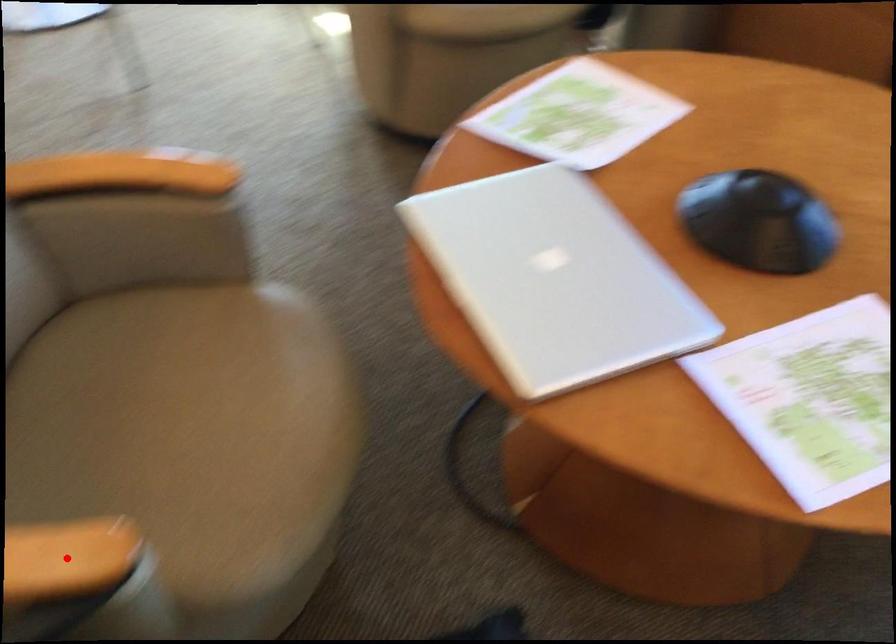
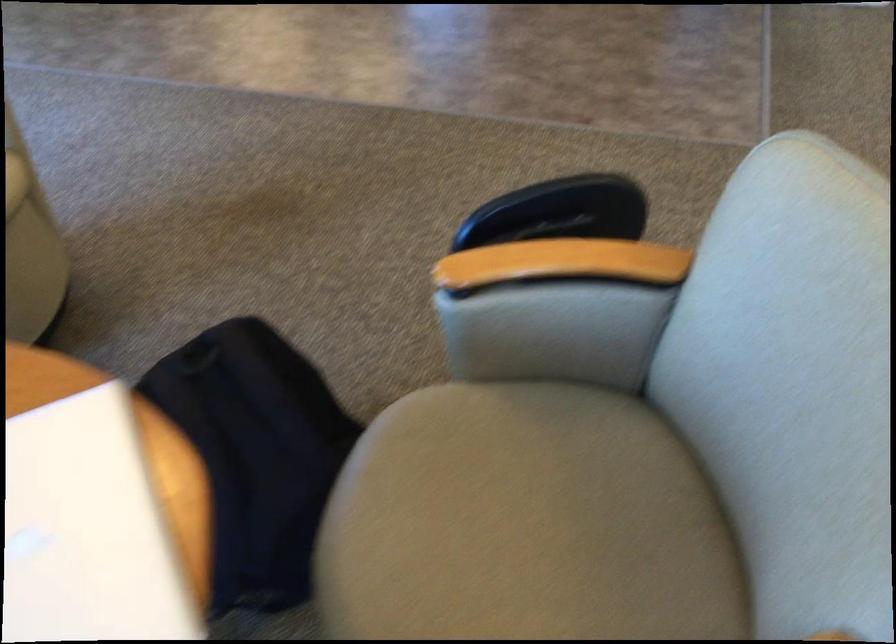
Question: I am providing you with two images of the same scene from different viewpoints. A red point is marked on the first image. At the location where the point appears in image 1, is it still visible in image 2?

Choices:
 (A) Yes
 (B) No

Answer: (B)